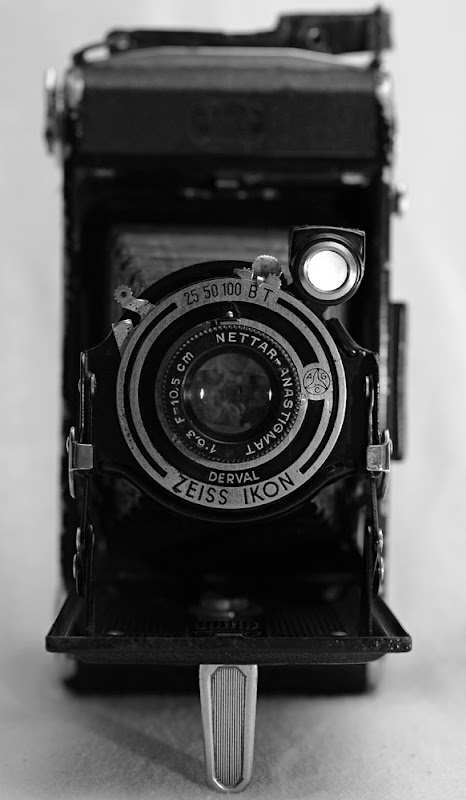
I want to click on stand, so (x=241, y=702).